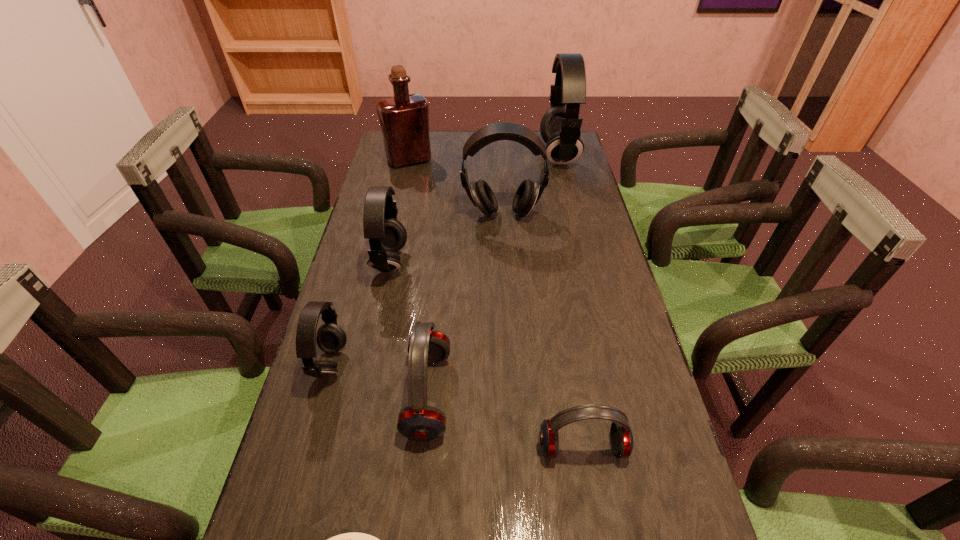
Where is `vacant area situated on the ear cups of the nearest black earphone`? vacant area situated on the ear cups of the nearest black earphone is located at coordinates (415, 364).

Where is `earphone present at the far edge`? The width and height of the screenshot is (960, 540). earphone present at the far edge is located at coordinates (560, 127).

Identify the location of liquor that is at the far edge. This screenshot has width=960, height=540. (404, 119).

This screenshot has width=960, height=540. Find the location of `liquor that is at the left edge`. liquor that is at the left edge is located at coordinates (404, 119).

What are the coordinates of `object at the far left corner` in the screenshot? It's located at (404, 119).

Where is `object at the far right corner`? The width and height of the screenshot is (960, 540). object at the far right corner is located at coordinates (560, 127).

Where is `vacant space at the far edge of the desktop`? The image size is (960, 540). vacant space at the far edge of the desktop is located at coordinates click(477, 156).

At what (x,y) coordinates should I click in order to perform the action: click on vacant region at the left edge of the desktop. Please return your answer as a coordinate pair (x, y). Looking at the image, I should click on (331, 516).

Locate an element on the screen. This screenshot has height=540, width=960. vacant region at the right edge of the desktop is located at coordinates (656, 513).

Locate an element on the screen. vacant point located between the fifth shortest object and the leftmost black earphone is located at coordinates (360, 314).